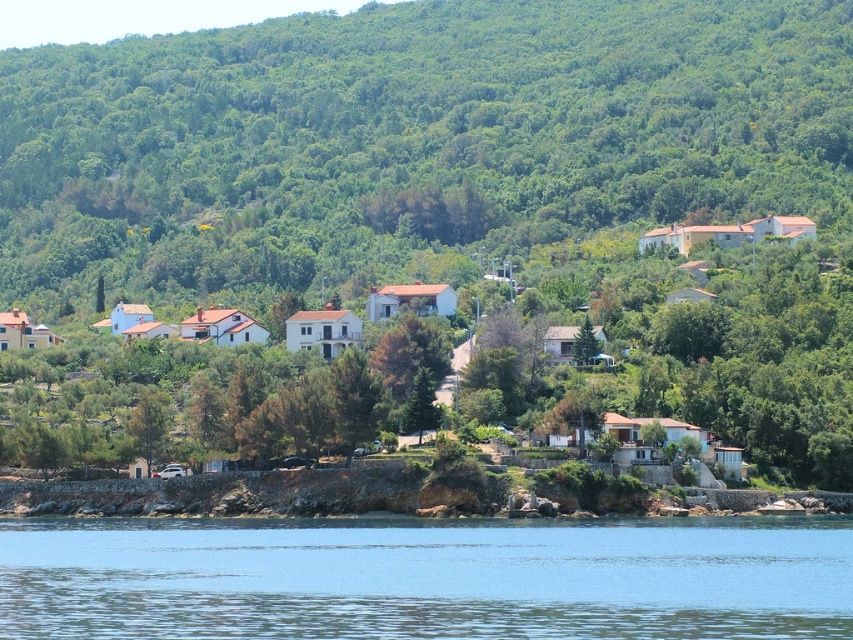
Question: Is green leafy tree at center to the left of transparent blue water at lower center from the viewer's perspective?

Choices:
 (A) no
 (B) yes

Answer: (B)

Question: Does green leafy tree at center appear on the right side of transparent blue water at lower center?

Choices:
 (A) yes
 (B) no

Answer: (B)

Question: Observing the image, what is the correct spatial positioning of green leafy tree at center in reference to transparent blue water at lower center?

Choices:
 (A) left
 (B) right

Answer: (A)

Question: Among these objects, which one is farthest from the camera?

Choices:
 (A) transparent blue water at lower center
 (B) green leafy tree at center

Answer: (B)